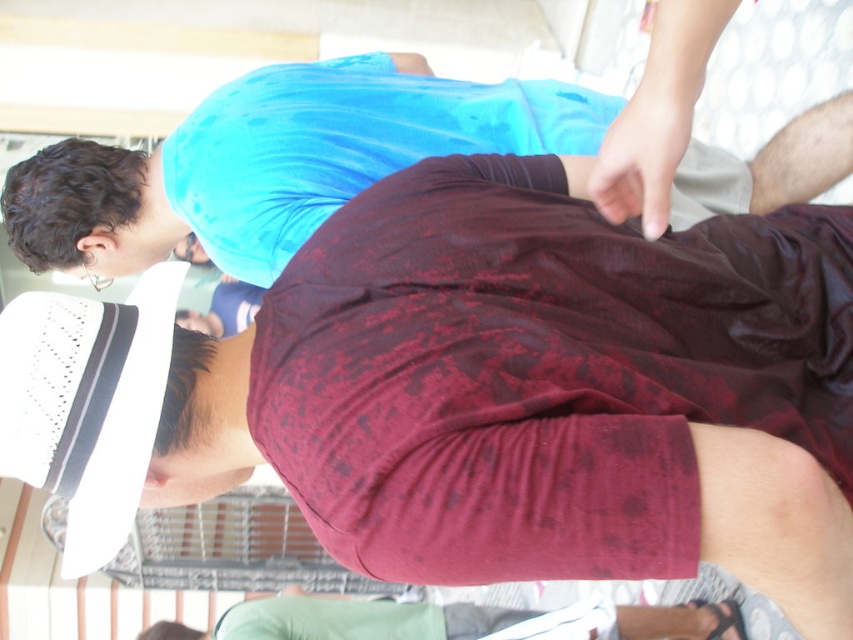
Question: Which object is the farthest from the matte blue shirt at upper center?

Choices:
 (A) maroon fabric shirt at lower center
 (B) maroon textured shirt at upper center

Answer: (B)

Question: Which object appears closest to the camera in this image?

Choices:
 (A) maroon textured shirt at upper center
 (B) matte blue shirt at upper center

Answer: (A)

Question: Is the position of maroon textured shirt at upper center less distant than that of matte blue shirt at upper center?

Choices:
 (A) yes
 (B) no

Answer: (A)

Question: Based on their relative distances, which object is farther from the matte blue shirt at upper center?

Choices:
 (A) maroon fabric shirt at lower center
 (B) maroon textured shirt at upper center

Answer: (B)

Question: Is maroon fabric shirt at lower center to the left of matte blue shirt at upper center from the viewer's perspective?

Choices:
 (A) yes
 (B) no

Answer: (B)

Question: In this image, where is maroon fabric shirt at lower center located relative to matte blue shirt at upper center?

Choices:
 (A) right
 (B) left

Answer: (A)